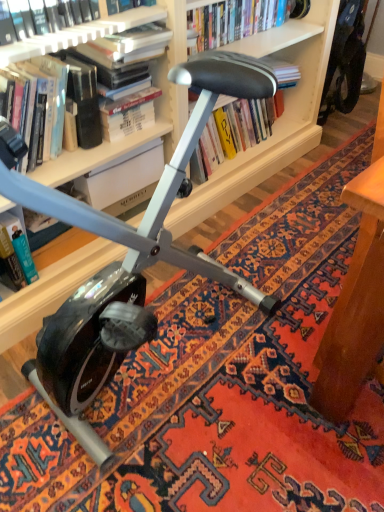
This screenshot has height=512, width=384. I want to click on matte white bookcase at upper center, so click(275, 121).

Image resolution: width=384 pixels, height=512 pixels. Describe the element at coordinates (123, 180) in the screenshot. I see `hardcover book at center` at that location.

The width and height of the screenshot is (384, 512). What do you see at coordinates (250, 121) in the screenshot? I see `hardcover book at center, which appears as the fourth book when viewed from the left` at bounding box center [250, 121].

Describe the element at coordinates (124, 58) in the screenshot. The image size is (384, 512). I see `hardcover book at upper center, which appears as the second book when viewed from the right` at that location.

At what (x,y) coordinates should I click in order to perform the action: click on matte white bookcase at upper center. Please return your answer as a coordinate pair (x, y). The height and width of the screenshot is (512, 384). Looking at the image, I should click on (275, 121).

Consider the image. Can you tell me how much hardcover book at left, which is counted as the 4th book, starting from the right, and hardcover book at upper left, which is the 3th book from right to left, differ in facing direction?

0.000125 degrees.

Does point (34, 267) come closer to viewer compared to point (2, 48)?

No, it is behind (2, 48).

Based on the photo, from the image's perspective, is hardcover book at left, which is counted as the 4th book, starting from the right, beneath hardcover book at upper left, which is the 3th book from right to left?

Yes, from the image's perspective, hardcover book at left, which is counted as the 4th book, starting from the right, is beneath hardcover book at upper left, which is the 3th book from right to left.

Who is smaller, hardcover book at left, the first book positioned from the left, or hardcover book at upper left, which is the 3th book from right to left?

Smaller between the two is hardcover book at left, the first book positioned from the left.

Considering the sizes of objects hardcover book at upper left, the second book when ordered from left to right, and hardcover book at center, which appears as the fourth book when viewed from the left, in the image provided, who is smaller, hardcover book at upper left, the second book when ordered from left to right, or hardcover book at center, which appears as the fourth book when viewed from the left,?

With smaller size is hardcover book at upper left, the second book when ordered from left to right.

Which object is wider, hardcover book at upper left, which is the 3th book from right to left, or hardcover book at center, which appears as the fourth book when viewed from the left?

With larger width is hardcover book at center, which appears as the fourth book when viewed from the left.

Choose the correct answer: Is hardcover book at upper left, the second book when ordered from left to right, inside hardcover book at center, positioned as the 1th book in right-to-left order, or outside it?

hardcover book at upper left, the second book when ordered from left to right, exists outside the volume of hardcover book at center, positioned as the 1th book in right-to-left order.

Is hardcover book at center far from hardcover book at upper center, the 3th book when ordered from left to right?

No, hardcover book at center is not far away from hardcover book at upper center, the 3th book when ordered from left to right.

From a real-world perspective, is hardcover book at center physically located above or below hardcover book at upper center, the 3th book when ordered from left to right?

From a real-world perspective, hardcover book at center is physically below hardcover book at upper center, the 3th book when ordered from left to right.

Is hardcover book at center bigger than hardcover book at upper center, the 3th book when ordered from left to right?

Actually, hardcover book at center might be smaller than hardcover book at upper center, the 3th book when ordered from left to right.

Between hardcover book at center and hardcover book at upper center, which appears as the second book when viewed from the right, which one appears on the left side from the viewer's perspective?

From the viewer's perspective, hardcover book at center appears more on the left side.

Which is in front, hardcover book at upper center, which appears as the second book when viewed from the right, or matte white bookcase at upper center?

Positioned in front is matte white bookcase at upper center.

Which object is positioned more to the left, hardcover book at upper center, which appears as the second book when viewed from the right, or matte white bookcase at upper center?

hardcover book at upper center, which appears as the second book when viewed from the right.

Is hardcover book at upper center, the 3th book when ordered from left to right, oriented towards matte white bookcase at upper center?

Yes, hardcover book at upper center, the 3th book when ordered from left to right, faces towards matte white bookcase at upper center.

Considering the relative sizes of hardcover book at left, the first book positioned from the left, and hardcover book at center in the image provided, is hardcover book at left, the first book positioned from the left, shorter than hardcover book at center?

Incorrect, the height of hardcover book at left, the first book positioned from the left, does not fall short of that of hardcover book at center.

From a real-world perspective, starting from the hardcover book at center, which book is the 2nd one below it? Please provide its 2D coordinates.

[(15, 254)]

From the image's perspective, is hardcover book at left, which is counted as the 4th book, starting from the right, located beneath hardcover book at center?

Correct, hardcover book at left, which is counted as the 4th book, starting from the right, appears lower than hardcover book at center in the image.

From the image's perspective, is matte white bookcase at upper center under hardcover book at left, the first book positioned from the left?

No, from the image's perspective, matte white bookcase at upper center is not below hardcover book at left, the first book positioned from the left.

From a real-world perspective, is matte white bookcase at upper center on hardcover book at left, the first book positioned from the left?

Yes, from a real-world perspective, matte white bookcase at upper center is on top of hardcover book at left, the first book positioned from the left.

Based on the photo, choose the correct answer: Is matte white bookcase at upper center inside hardcover book at left, the first book positioned from the left, or outside it?

matte white bookcase at upper center is located beyond the bounds of hardcover book at left, the first book positioned from the left.

Who is taller, hardcover book at center, which appears as the fourth book when viewed from the left, or hardcover book at upper center, the 3th book when ordered from left to right?

hardcover book at upper center, the 3th book when ordered from left to right.

Is hardcover book at center, positioned as the 1th book in right-to-left order, not near hardcover book at upper center, which appears as the second book when viewed from the right?

No, hardcover book at center, positioned as the 1th book in right-to-left order, is in close proximity to hardcover book at upper center, which appears as the second book when viewed from the right.

Which object is closer to the camera, hardcover book at center, which appears as the fourth book when viewed from the left, or hardcover book at upper center, which appears as the second book when viewed from the right?

hardcover book at upper center, which appears as the second book when viewed from the right, is closer to the camera.

From the hardcover book at left, which is counted as the 4th book, starting from the right, count 2nd books forward and point to it. Please provide its 2D coordinates.

[(78, 34)]

Starting from the hardcover book at center, which appears as the fourth book when viewed from the left, which book is the 2nd one to the left? Please provide its 2D coordinates.

[(78, 34)]

Looking at the image, which one is located closer to hardcover book at center, which appears as the fourth book when viewed from the left, hardcover book at upper left, the second book when ordered from left to right, or hardcover book at upper center, which appears as the second book when viewed from the right?

Based on the image, hardcover book at upper center, which appears as the second book when viewed from the right, appears to be nearer to hardcover book at center, which appears as the fourth book when viewed from the left.

When comparing their distances from hardcover book at upper left, the second book when ordered from left to right, does hardcover book at upper center, which appears as the second book when viewed from the right, or matte white bookcase at upper center seem closer?

→ hardcover book at upper center, which appears as the second book when viewed from the right, is positioned closer to the anchor hardcover book at upper left, the second book when ordered from left to right.

Looking at this image, estimate the real-world distances between objects in this image. Which object is closer to hardcover book at upper left, which is the 3th book from right to left, hardcover book at center or hardcover book at left, which is counted as the 4th book, starting from the right?

hardcover book at center.

Looking at the image, which one is located closer to hardcover book at upper left, which is the 3th book from right to left, hardcover book at center, positioned as the 1th book in right-to-left order, or hardcover book at left, which is counted as the 4th book, starting from the right?

Among the two, hardcover book at left, which is counted as the 4th book, starting from the right, is located nearer to hardcover book at upper left, which is the 3th book from right to left.

Which object lies further to the anchor point matte white bookcase at upper center, hardcover book at left, the first book positioned from the left, or hardcover book at center, positioned as the 1th book in right-to-left order?

Among the two, hardcover book at left, the first book positioned from the left, is located further to matte white bookcase at upper center.

In the scene shown: Based on their spatial positions, is matte white bookcase at upper center or hardcover book at center, positioned as the 1th book in right-to-left order, closer to hardcover book at upper left, which is the 3th book from right to left?

hardcover book at center, positioned as the 1th book in right-to-left order, lies closer to hardcover book at upper left, which is the 3th book from right to left, than the other object.

Estimate the real-world distances between objects in this image. Which object is further from hardcover book at upper left, which is the 3th book from right to left, hardcover book at center, which appears as the fourth book when viewed from the left, or hardcover book at upper center, which appears as the second book when viewed from the right?

Among the two, hardcover book at center, which appears as the fourth book when viewed from the left, is located further to hardcover book at upper left, which is the 3th book from right to left.

From the image, which object appears to be nearer to hardcover book at center, hardcover book at center, which appears as the fourth book when viewed from the left, or hardcover book at upper left, the second book when ordered from left to right?

Among the two, hardcover book at center, which appears as the fourth book when viewed from the left, is located nearer to hardcover book at center.

Where is `paperback book between hardcover book at left, the first book positioned from the left, and hardcover book at center, which appears as the fourth book when viewed from the left, in the horizontal direction`? This screenshot has height=512, width=384. paperback book between hardcover book at left, the first book positioned from the left, and hardcover book at center, which appears as the fourth book when viewed from the left, in the horizontal direction is located at coordinates (123, 180).

Where is `book between matte white bookcase at upper center and hardcover book at upper center, which appears as the second book when viewed from the right, from front to back`? This screenshot has height=512, width=384. book between matte white bookcase at upper center and hardcover book at upper center, which appears as the second book when viewed from the right, from front to back is located at coordinates (78, 34).

I want to click on book between hardcover book at upper center, the 3th book when ordered from left to right, and hardcover book at left, the first book positioned from the left, from top to bottom, so click(78, 34).

Image resolution: width=384 pixels, height=512 pixels. I want to click on paperback book between matte white bookcase at upper center and hardcover book at center, which appears as the fourth book when viewed from the left, from front to back, so click(x=123, y=180).